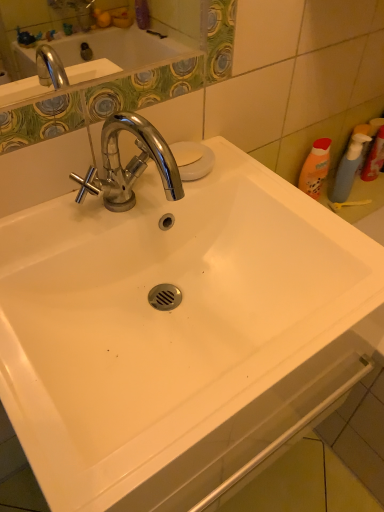
Question: From the image's perspective, is translucent plastic spray bottle at right, arranged as the second cleaning product when viewed from the left, beneath white matte soap at upper center?

Choices:
 (A) yes
 (B) no

Answer: (B)

Question: From the image's perspective, does translucent plastic spray bottle at right, which is the first cleaning product in right-to-left order, appear higher than white matte soap at upper center?

Choices:
 (A) no
 (B) yes

Answer: (B)

Question: Considering the relative sizes of translucent plastic spray bottle at right, arranged as the second cleaning product when viewed from the left, and white matte soap at upper center in the image provided, is translucent plastic spray bottle at right, arranged as the second cleaning product when viewed from the left, taller than white matte soap at upper center?

Choices:
 (A) yes
 (B) no

Answer: (A)

Question: Is the position of translucent plastic spray bottle at right, arranged as the second cleaning product when viewed from the left, less distant than that of white matte soap at upper center?

Choices:
 (A) yes
 (B) no

Answer: (B)

Question: Considering the relative sizes of translucent plastic spray bottle at right, which is the first cleaning product in right-to-left order, and white matte soap at upper center in the image provided, is translucent plastic spray bottle at right, which is the first cleaning product in right-to-left order, bigger than white matte soap at upper center?

Choices:
 (A) yes
 (B) no

Answer: (A)

Question: Could you tell me if translucent plastic spray bottle at right, arranged as the second cleaning product when viewed from the left, is facing white matte soap at upper center?

Choices:
 (A) no
 (B) yes

Answer: (A)

Question: Can translucent plastic spray bottle at right, arranged as the second cleaning product when viewed from the left, be found inside translucent blue spray bottle at right, the first cleaning product from the left?

Choices:
 (A) no
 (B) yes

Answer: (A)

Question: Is translucent blue spray bottle at right, the first cleaning product from the left, positioned before translucent plastic spray bottle at right, which is the first cleaning product in right-to-left order?

Choices:
 (A) yes
 (B) no

Answer: (B)

Question: Is translucent blue spray bottle at right, the first cleaning product from the left, outside translucent plastic spray bottle at right, arranged as the second cleaning product when viewed from the left?

Choices:
 (A) yes
 (B) no

Answer: (A)

Question: From the image's perspective, would you say translucent blue spray bottle at right, the second cleaning product in the right-to-left sequence, is shown under translucent plastic spray bottle at right, arranged as the second cleaning product when viewed from the left?

Choices:
 (A) no
 (B) yes

Answer: (B)

Question: Considering the relative sizes of translucent blue spray bottle at right, the second cleaning product in the right-to-left sequence, and translucent plastic spray bottle at right, which is the first cleaning product in right-to-left order, in the image provided, is translucent blue spray bottle at right, the second cleaning product in the right-to-left sequence, thinner than translucent plastic spray bottle at right, which is the first cleaning product in right-to-left order,?

Choices:
 (A) no
 (B) yes

Answer: (B)

Question: From the image's perspective, does translucent blue spray bottle at right, the second cleaning product in the right-to-left sequence, appear higher than translucent plastic spray bottle at right, arranged as the second cleaning product when viewed from the left?

Choices:
 (A) no
 (B) yes

Answer: (A)

Question: Considering the relative positions of white matte soap at upper center and translucent plastic spray bottle at right, which is the first cleaning product in right-to-left order, in the image provided, is white matte soap at upper center to the left of translucent plastic spray bottle at right, which is the first cleaning product in right-to-left order, from the viewer's perspective?

Choices:
 (A) yes
 (B) no

Answer: (A)